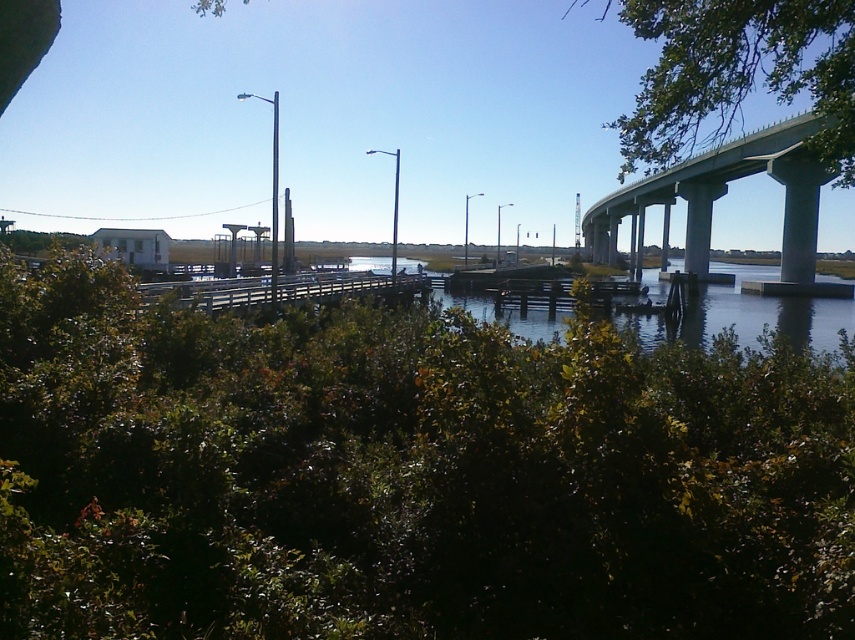
What do you see at coordinates (723, 195) in the screenshot?
I see `gray concrete overpass at upper right` at bounding box center [723, 195].

The width and height of the screenshot is (855, 640). I want to click on gray concrete overpass at upper right, so click(723, 195).

Is point (795, 147) farther from camera compared to point (375, 289)?

No, (795, 147) is in front of (375, 289).

At what (x,y) coordinates should I click in order to perform the action: click on gray concrete overpass at upper right. Please return your answer as a coordinate pair (x, y). Image resolution: width=855 pixels, height=640 pixels. Looking at the image, I should click on pyautogui.click(x=723, y=195).

Does green leafy shrubs at lower center appear on the left side of green leafy tree at upper right?

Indeed, green leafy shrubs at lower center is positioned on the left side of green leafy tree at upper right.

Who is more forward, [853,531] or [699,10]?

Positioned in front is point [853,531].

Between point (624, 557) and point (840, 120), which one is positioned in front?

Point (624, 557)

I want to click on green leafy shrubs at lower center, so click(x=407, y=476).

Can you confirm if green leafy shrubs at lower center is smaller than wooden dock at center?

Correct, green leafy shrubs at lower center occupies less space than wooden dock at center.

Based on the photo, is green leafy shrubs at lower center behind wooden dock at center?

No, it is not.

Is point (146, 412) farther from viewer compared to point (193, 305)?

No, it is in front of (193, 305).

The height and width of the screenshot is (640, 855). In order to click on green leafy shrubs at lower center in this screenshot , I will do `click(407, 476)`.